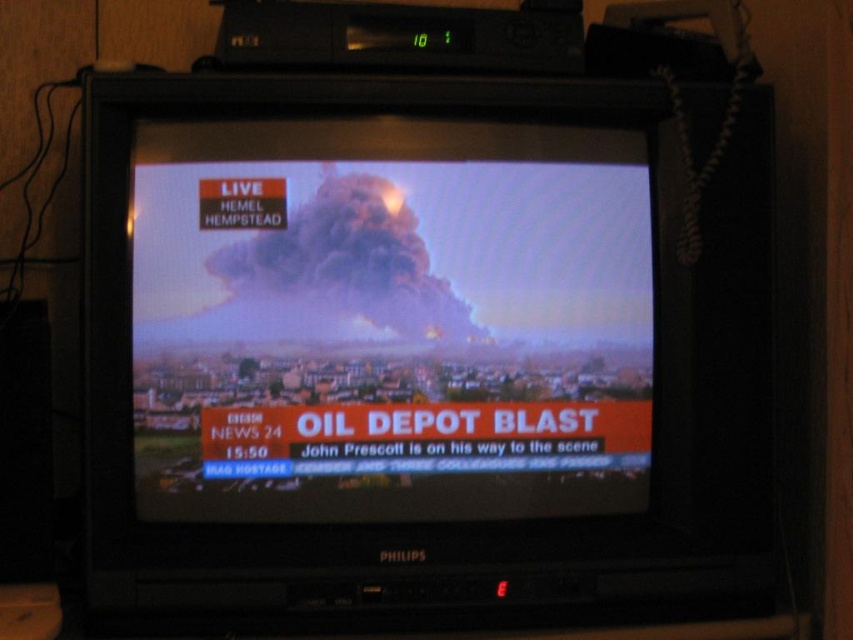
Question: Can you confirm if smoke cloud at center is positioned below smokedark gray/blackcloud at center?

Choices:
 (A) yes
 (B) no

Answer: (A)

Question: Can you confirm if smoke cloud at center is positioned to the right of smokedark gray/blackcloud at center?

Choices:
 (A) yes
 (B) no

Answer: (A)

Question: Among these objects, which one is nearest to the camera?

Choices:
 (A) smoke cloud at center
 (B) smokedark gray/blackcloud at center

Answer: (A)

Question: Observing the image, what is the correct spatial positioning of smoke cloud at center in reference to smokedark gray/blackcloud at center?

Choices:
 (A) right
 (B) left

Answer: (A)